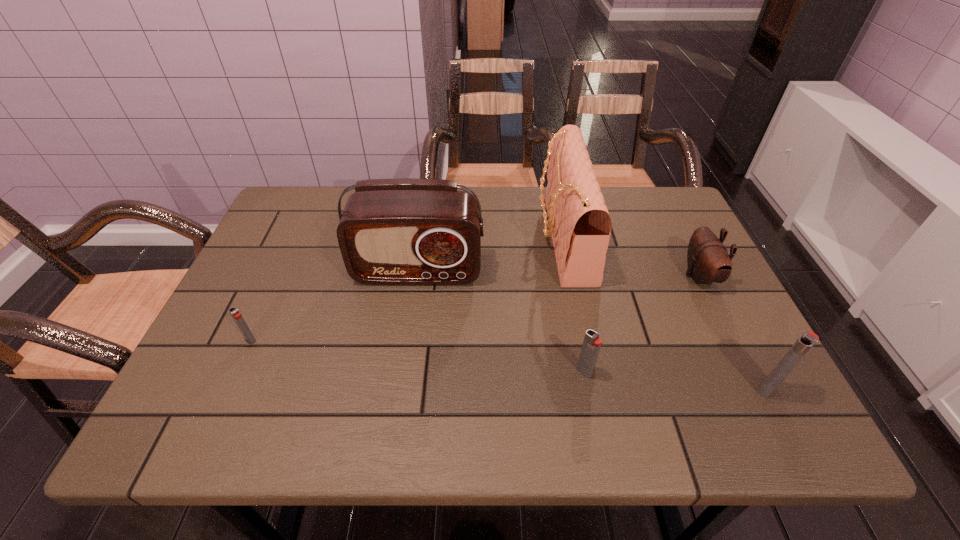
Identify the location of vacant region located 0.100m on the left of the fifth farthest object. This screenshot has height=540, width=960. (529, 372).

You are a GUI agent. You are given a task and a screenshot of the screen. Output one action in this format:
    pyautogui.click(x=<x>, y=<y>)
    Task: Click on the blank space located on the left of the tallest igniter
    
    Given the screenshot: What is the action you would take?
    pyautogui.click(x=563, y=389)

You are a GUI agent. You are given a task and a screenshot of the screen. Output one action in this format:
    pyautogui.click(x=<x>, y=<y>)
    Task: Click on the vacant space positioned on the front-facing side of the handbag
    The image size is (960, 540).
    Given the screenshot: What is the action you would take?
    coord(477,238)

Locate an element on the screen. free space located on the front-facing side of the handbag is located at coordinates (456, 238).

You are a GUI agent. You are given a task and a screenshot of the screen. Output one action in this format:
    pyautogui.click(x=<x>, y=<y>)
    Task: Click on the vacant space located on the front-facing side of the handbag
    
    Given the screenshot: What is the action you would take?
    pyautogui.click(x=448, y=238)

Locate an element on the screen. free space located 0.360m with the flap open on the pouch is located at coordinates (543, 276).

The image size is (960, 540). I want to click on vacant space located with the flap open on the pouch, so click(x=630, y=276).

You are a GUI agent. You are given a task and a screenshot of the screen. Output one action in this format:
    pyautogui.click(x=<x>, y=<y>)
    Task: Click on the free location located with the flap open on the pouch
    
    Given the screenshot: What is the action you would take?
    pyautogui.click(x=566, y=276)

The image size is (960, 540). I want to click on vacant space located 0.100m on the front panel of the fifth object from right to left, so click(x=411, y=318).

Where is `object that is at the far edge`? The width and height of the screenshot is (960, 540). object that is at the far edge is located at coordinates (579, 222).